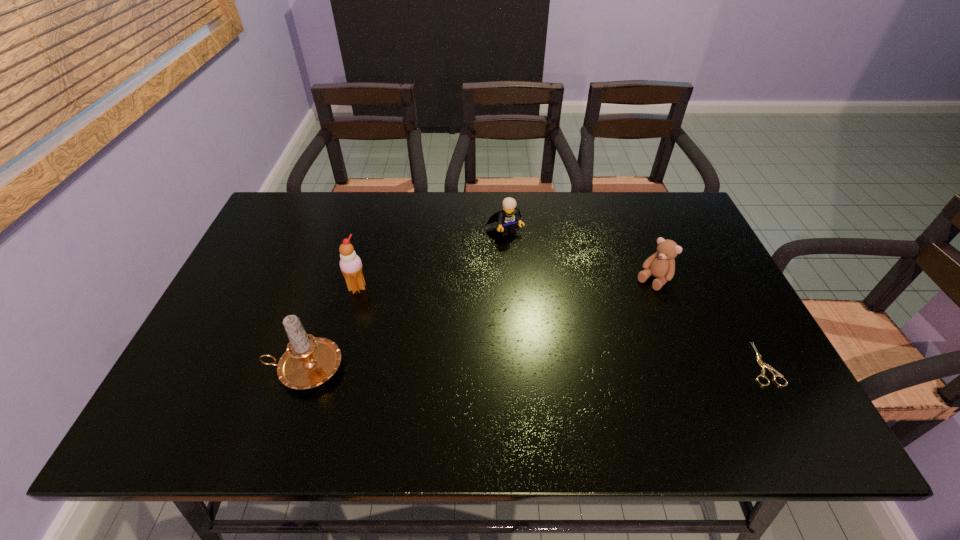
Locate an element on the screen. vacant region located 0.150m at the front with a straw on the icecream is located at coordinates (405, 320).

Where is `free location located 0.130m at the front with a straw on the icecream`? free location located 0.130m at the front with a straw on the icecream is located at coordinates (399, 316).

Locate an element on the screen. vacant space located 0.390m on the front-facing side of the second object from right to left is located at coordinates (557, 382).

The width and height of the screenshot is (960, 540). I want to click on vacant space located 0.140m on the front-facing side of the second object from right to left, so click(x=616, y=319).

Where is `free location located 0.330m on the front-facing side of the second object from right to left`? Image resolution: width=960 pixels, height=540 pixels. free location located 0.330m on the front-facing side of the second object from right to left is located at coordinates (572, 366).

I want to click on free space located 0.290m on the front-facing side of the third object from right to left, so click(x=554, y=308).

At what (x,y) coordinates should I click in order to perform the action: click on vacant area situated 0.340m on the front-facing side of the third object from right to left. Please return your answer as a coordinate pair (x, y). The width and height of the screenshot is (960, 540). Looking at the image, I should click on (564, 323).

Image resolution: width=960 pixels, height=540 pixels. I want to click on free space located 0.300m on the front-facing side of the third object from right to left, so click(x=556, y=311).

Identify the location of object at the far edge. This screenshot has height=540, width=960. (507, 219).

I want to click on candle at the near edge, so click(x=309, y=361).